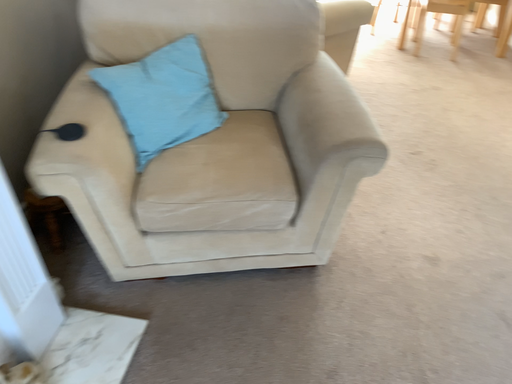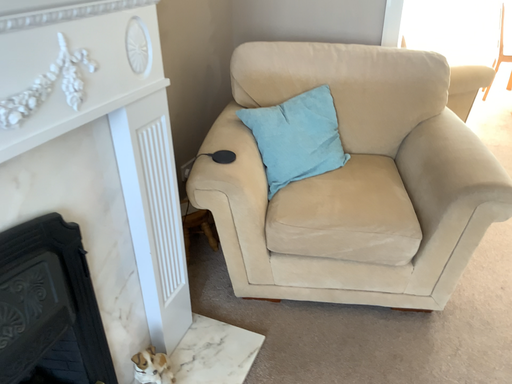
Question: How did the camera likely rotate when shooting the video?

Choices:
 (A) rotated left
 (B) rotated right

Answer: (A)